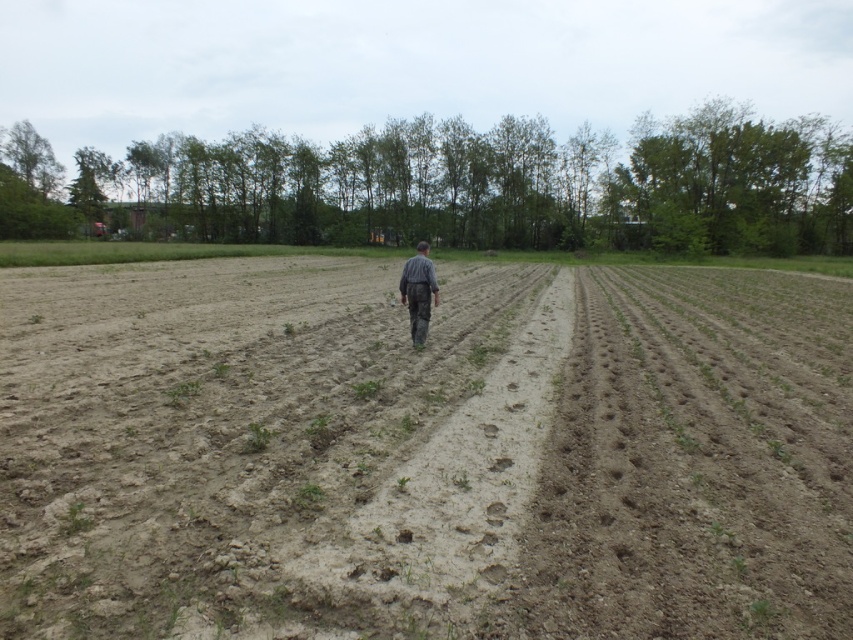
You are a farmer observing the field. You notice the brown soil at center and the gray striped shirt at center. Which object is taller?

The gray striped shirt at center is taller than the brown soil at center.

You are a farmer standing at the edge of the field. You see the brown soil at center and the gray striped shirt at center. Which object is closer to you?

The brown soil at center is closer to you because it is in front of the gray striped shirt at center.

You are standing in the middle of the field and want to reach the barn in the background. There are two points marked in the field, point A at coordinates point [311,372] and point B at coordinates point [418,324]. Which point should you walk towards to get closer to the barn?

You should walk towards point B at coordinates point [418,324] because it is further away from the viewer compared to point A, bringing you closer to the barn in the background.